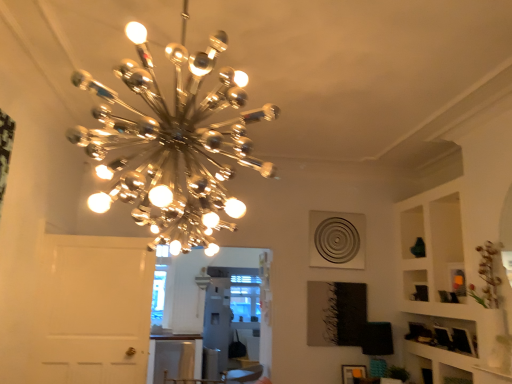
Question: Is matte orange picture frame at lower right wider than chrome/metallic chandelier at upper center?

Choices:
 (A) yes
 (B) no

Answer: (B)

Question: Considering the relative positions of matte orange picture frame at lower right and chrome/metallic chandelier at upper center in the image provided, is matte orange picture frame at lower right to the left of chrome/metallic chandelier at upper center from the viewer's perspective?

Choices:
 (A) yes
 (B) no

Answer: (B)

Question: Is matte orange picture frame at lower right taller than chrome/metallic chandelier at upper center?

Choices:
 (A) yes
 (B) no

Answer: (B)

Question: From the image's perspective, would you say matte orange picture frame at lower right is shown under chrome/metallic chandelier at upper center?

Choices:
 (A) yes
 (B) no

Answer: (A)

Question: Is matte orange picture frame at lower right oriented away from chrome/metallic chandelier at upper center?

Choices:
 (A) no
 (B) yes

Answer: (A)

Question: Is chrome/metallic chandelier at upper center located within matte orange picture frame at lower right?

Choices:
 (A) no
 (B) yes

Answer: (A)

Question: From a real-world perspective, is chrome/metallic chandelier at upper center on top of white glossy table at lower center?

Choices:
 (A) no
 (B) yes

Answer: (B)

Question: Does chrome/metallic chandelier at upper center have a larger size compared to white glossy table at lower center?

Choices:
 (A) no
 (B) yes

Answer: (A)

Question: Considering the relative positions of chrome/metallic chandelier at upper center and white glossy table at lower center in the image provided, is chrome/metallic chandelier at upper center to the left of white glossy table at lower center from the viewer's perspective?

Choices:
 (A) yes
 (B) no

Answer: (B)

Question: Is chrome/metallic chandelier at upper center looking in the opposite direction of white glossy table at lower center?

Choices:
 (A) no
 (B) yes

Answer: (A)

Question: Considering the relative sizes of chrome/metallic chandelier at upper center and white glossy table at lower center in the image provided, is chrome/metallic chandelier at upper center shorter than white glossy table at lower center?

Choices:
 (A) yes
 (B) no

Answer: (B)

Question: From the image's perspective, is chrome/metallic chandelier at upper center over white glossy table at lower center?

Choices:
 (A) yes
 (B) no

Answer: (A)

Question: Is white glossy table at lower center behind matte orange picture frame at lower right?

Choices:
 (A) no
 (B) yes

Answer: (B)